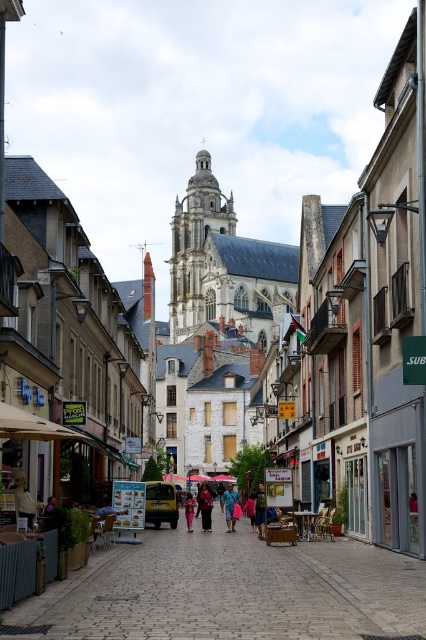
You are standing on the cobblestone street in front of the white stone church at center and the white stone tower at center. Which structure is nearer to you?

The white stone church at center is closer to the viewer than the white stone tower at center.